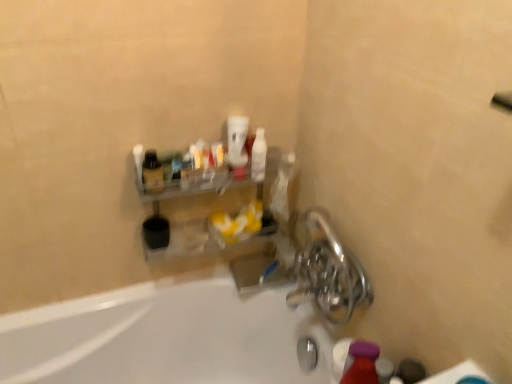
What do you see at coordinates (224, 211) in the screenshot? I see `clear plastic shelf at upper center` at bounding box center [224, 211].

The width and height of the screenshot is (512, 384). What do you see at coordinates (237, 144) in the screenshot? I see `white glossy cup at upper center, positioned as the 1th mouthwash in left-to-right order` at bounding box center [237, 144].

At what (x,y) coordinates should I click in order to perform the action: click on white glossy bathtub at lower left. Please return your answer as a coordinate pair (x, y). Looking at the image, I should click on (164, 338).

This screenshot has width=512, height=384. What do you see at coordinates (361, 363) in the screenshot?
I see `matte purple bottle at lower right` at bounding box center [361, 363].

Measure the distance between matte purple bottle at lower right and camera.

A distance of 83.76 centimeters exists between matte purple bottle at lower right and camera.

What do you see at coordinates (152, 172) in the screenshot? I see `matte black bottle at upper left` at bounding box center [152, 172].

Identify the location of clear plastic shelf at upper center. (224, 211).

Is white glossy bottle at upper center, placed as the second mouthwash when sorted from left to right, taller than clear plastic shelf at upper center?

In fact, white glossy bottle at upper center, placed as the second mouthwash when sorted from left to right, may be shorter than clear plastic shelf at upper center.

Starting from the clear plastic shelf at upper center, which mouthwash is the 2nd one behind? Please provide its 2D coordinates.

[(259, 156)]

Does white glossy bottle at upper center, the 1th mouthwash positioned from the right, lie behind clear plastic shelf at upper center?

Yes, white glossy bottle at upper center, the 1th mouthwash positioned from the right, is further from the camera.

Do you think white glossy bottle at upper center, placed as the second mouthwash when sorted from left to right, is within clear plastic shelf at upper center, or outside of it?

white glossy bottle at upper center, placed as the second mouthwash when sorted from left to right, exists entirely within clear plastic shelf at upper center.

Can you tell me how much matte purple bottle at lower right and shiny metallic faucet at lower right differ in facing direction?

51.6 degrees.

Is matte purple bottle at lower right wider or thinner than shiny metallic faucet at lower right?

In the image, matte purple bottle at lower right appears to be more narrow than shiny metallic faucet at lower right.

Is point (358, 343) positioned after point (297, 239)?

No, (358, 343) is in front of (297, 239).

From the picture: Considering the relative sizes of matte purple bottle at lower right and shiny metallic faucet at lower right in the image provided, is matte purple bottle at lower right bigger than shiny metallic faucet at lower right?

No, matte purple bottle at lower right is not bigger than shiny metallic faucet at lower right.

Based on the photo, would you say white glossy bottle at upper center, the 1th mouthwash positioned from the right, is inside or outside white glossy cup at upper center, which ranks as the 2th mouthwash in right-to-left order?

white glossy bottle at upper center, the 1th mouthwash positioned from the right, is outside white glossy cup at upper center, which ranks as the 2th mouthwash in right-to-left order.

Which of these two, white glossy bottle at upper center, the 1th mouthwash positioned from the right, or white glossy cup at upper center, positioned as the 1th mouthwash in left-to-right order, stands shorter?

With less height is white glossy bottle at upper center, the 1th mouthwash positioned from the right.

From a real-world perspective, is white glossy bottle at upper center, placed as the second mouthwash when sorted from left to right, above or below white glossy cup at upper center, which ranks as the 2th mouthwash in right-to-left order?

From a real-world perspective, white glossy bottle at upper center, placed as the second mouthwash when sorted from left to right, is physically below white glossy cup at upper center, which ranks as the 2th mouthwash in right-to-left order.

Find the location of a particular element. mouthwash behind the white glossy cup at upper center, which ranks as the 2th mouthwash in right-to-left order is located at coordinates (259, 156).

Which of these two, shiny metallic faucet at lower right or white glossy bathtub at lower left, is bigger?

With larger size is white glossy bathtub at lower left.

Based on the photo, can you confirm if shiny metallic faucet at lower right is positioned to the left of white glossy bathtub at lower left?

In fact, shiny metallic faucet at lower right is to the right of white glossy bathtub at lower left.

Which of these two, shiny metallic faucet at lower right or white glossy bathtub at lower left, is wider?

With larger width is white glossy bathtub at lower left.

Is shiny metallic faucet at lower right spatially inside white glossy bathtub at lower left, or outside of it?

shiny metallic faucet at lower right is located beyond the bounds of white glossy bathtub at lower left.

Considering the relative sizes of white glossy bottle at upper center, the 1th mouthwash positioned from the right, and matte black bottle at upper left in the image provided, is white glossy bottle at upper center, the 1th mouthwash positioned from the right, bigger than matte black bottle at upper left?

Yes, white glossy bottle at upper center, the 1th mouthwash positioned from the right, is bigger than matte black bottle at upper left.

Considering the relative positions of white glossy bottle at upper center, placed as the second mouthwash when sorted from left to right, and matte black bottle at upper left in the image provided, is white glossy bottle at upper center, placed as the second mouthwash when sorted from left to right, to the left of matte black bottle at upper left from the viewer's perspective?

No, white glossy bottle at upper center, placed as the second mouthwash when sorted from left to right, is not to the left of matte black bottle at upper left.

Would you say white glossy bottle at upper center, the 1th mouthwash positioned from the right, is outside matte black bottle at upper left?

Indeed, white glossy bottle at upper center, the 1th mouthwash positioned from the right, is completely outside matte black bottle at upper left.

From the image's perspective, between shiny metallic faucet at lower right and matte black bottle at upper left, which one is located above?

matte black bottle at upper left is shown above in the image.

Is shiny metallic faucet at lower right placed right next to matte black bottle at upper left?

shiny metallic faucet at lower right and matte black bottle at upper left are not in contact.

Does point (312, 241) come behind point (158, 182)?

Yes, point (312, 241) is farther from viewer.

What's the angular difference between shiny metallic faucet at lower right and matte black bottle at upper left's facing directions?

The angle between the facing direction of shiny metallic faucet at lower right and the facing direction of matte black bottle at upper left is 85.3 degrees.

Considering the relative positions of white glossy bathtub at lower left and matte black bottle at upper left in the image provided, is white glossy bathtub at lower left to the right of matte black bottle at upper left from the viewer's perspective?

Indeed, white glossy bathtub at lower left is positioned on the right side of matte black bottle at upper left.

Is white glossy bathtub at lower left thinner than matte black bottle at upper left?

No.

From a real-world perspective, is white glossy bathtub at lower left physically located above or below matte black bottle at upper left?

In terms of real-world spatial position, white glossy bathtub at lower left is below matte black bottle at upper left.

Locate an element on the screen. The height and width of the screenshot is (384, 512). mouthwash that is the 1st one when counting upward from the clear plastic shelf at upper center (from the image's perspective) is located at coordinates (259, 156).

The height and width of the screenshot is (384, 512). I want to click on tap lying in front of the matte purple bottle at lower right, so point(327,270).

When comparing their distances from white glossy bottle at upper center, the 1th mouthwash positioned from the right, does white glossy bathtub at lower left or shiny metallic faucet at lower right seem closer?

shiny metallic faucet at lower right.

Considering their positions, is white glossy bathtub at lower left positioned further to matte purple bottle at lower right than white glossy bottle at upper center, the 1th mouthwash positioned from the right?

The object further to matte purple bottle at lower right is white glossy bathtub at lower left.

Considering their positions, is matte purple bottle at lower right positioned closer to matte black bottle at upper left than white glossy bottle at upper center, placed as the second mouthwash when sorted from left to right?

Among the two, white glossy bottle at upper center, placed as the second mouthwash when sorted from left to right, is located nearer to matte black bottle at upper left.

Based on their spatial positions, is white glossy cup at upper center, which ranks as the 2th mouthwash in right-to-left order, or clear plastic shelf at upper center closer to shiny metallic faucet at lower right?

Among the two, clear plastic shelf at upper center is located nearer to shiny metallic faucet at lower right.

Which object lies further to the anchor point white glossy bottle at upper center, the 1th mouthwash positioned from the right, clear plastic shelf at upper center or matte black bottle at upper left?

Based on the image, matte black bottle at upper left appears to be further to white glossy bottle at upper center, the 1th mouthwash positioned from the right.

When comparing their distances from matte purple bottle at lower right, does clear plastic shelf at upper center or matte black bottle at upper left seem closer?

clear plastic shelf at upper center is closer to matte purple bottle at lower right.

Estimate the real-world distances between objects in this image. Which object is closer to white glossy bottle at upper center, placed as the second mouthwash when sorted from left to right, matte purple bottle at lower right or clear plastic shelf at upper center?

clear plastic shelf at upper center.

Estimate the real-world distances between objects in this image. Which object is further from white glossy bathtub at lower left, matte black bottle at upper left or clear plastic shelf at upper center?

The object further to white glossy bathtub at lower left is matte black bottle at upper left.

You are a GUI agent. You are given a task and a screenshot of the screen. Output one action in this format:
    pyautogui.click(x=<x>, y=<y>)
    Task: Click on the bottle between white glossy cup at upper center, positioned as the 1th mouthwash in left-to-right order, and matte purple bottle at lower right in the up-down direction
    Image resolution: width=512 pixels, height=384 pixels.
    Given the screenshot: What is the action you would take?
    pyautogui.click(x=152, y=172)

Locate an element on the screen. The width and height of the screenshot is (512, 384). toiletry between matte black bottle at upper left and white glossy bathtub at lower left vertically is located at coordinates (361, 363).

Where is `mouthwash between white glossy cup at upper center, positioned as the 1th mouthwash in left-to-right order, and shiny metallic faucet at lower right vertically`? The height and width of the screenshot is (384, 512). mouthwash between white glossy cup at upper center, positioned as the 1th mouthwash in left-to-right order, and shiny metallic faucet at lower right vertically is located at coordinates (259, 156).

Locate an element on the screen. shelf located between matte black bottle at upper left and shiny metallic faucet at lower right in the left-right direction is located at coordinates (224, 211).